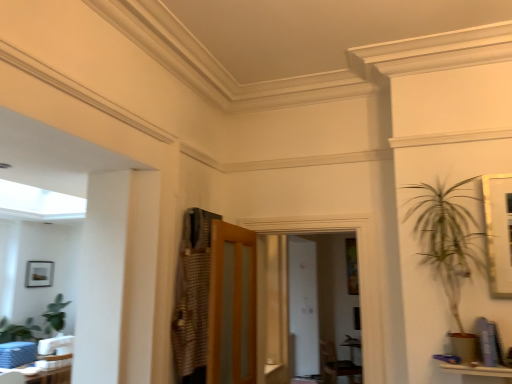
Question: Is white glossy table at lower left inside the boundaries of dark brown leather armchair at center, or outside?

Choices:
 (A) outside
 (B) inside

Answer: (A)

Question: Based on their sizes in the image, would you say white glossy table at lower left is bigger or smaller than dark brown leather armchair at center?

Choices:
 (A) small
 (B) big

Answer: (A)

Question: Which object is the closest to the dark brown leather armchair at center?

Choices:
 (A) matte black picture frame at left
 (B) wooden frosted glass door at center
 (C) checkered fabric armoire at center
 (D) white glossy table at lower left

Answer: (D)

Question: Estimate the real-world distances between objects in this image. Which object is farther from the white glossy table at lower left?

Choices:
 (A) checkered fabric armoire at center
 (B) dark brown leather armchair at center
 (C) wooden frosted glass door at center
 (D) matte black picture frame at left

Answer: (B)